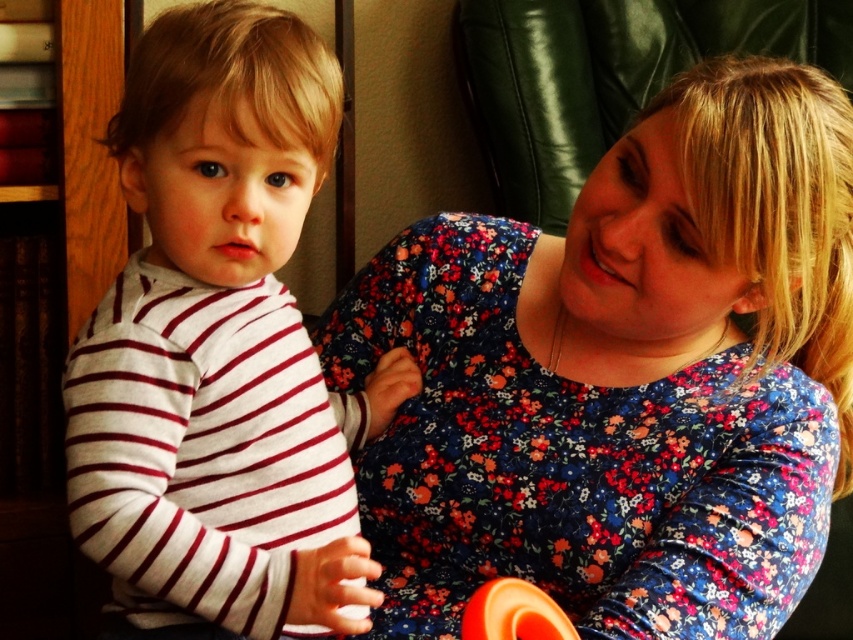
Does point (675, 538) come behind point (503, 625)?

Yes, point (675, 538) is behind point (503, 625).

Is floral fabric dress at center taller than orange rubber ring at lower center?

Indeed, floral fabric dress at center has a greater height compared to orange rubber ring at lower center.

What are the coordinates of `floral fabric dress at center` in the screenshot? It's located at (624, 376).

Where is `floral fabric dress at center`? This screenshot has height=640, width=853. floral fabric dress at center is located at coordinates (624, 376).

Does white striped shirt at left have a smaller size compared to orange rubber ring at lower center?

Actually, white striped shirt at left might be larger than orange rubber ring at lower center.

Is white striped shirt at left wider than orange rubber ring at lower center?

Yes, white striped shirt at left is wider than orange rubber ring at lower center.

Is point (210, 394) closer to camera compared to point (523, 611)?

No.

In order to click on white striped shirt at left in this screenshot , I will do `click(219, 348)`.

Is floral fabric dress at center bigger than white striped shirt at left?

Yes.

Is floral fabric dress at center smaller than white striped shirt at left?

Incorrect, floral fabric dress at center is not smaller in size than white striped shirt at left.

Is point (688, 147) closer to camera compared to point (263, 129)?

No.

Locate an element on the screen. floral fabric dress at center is located at coordinates (624, 376).